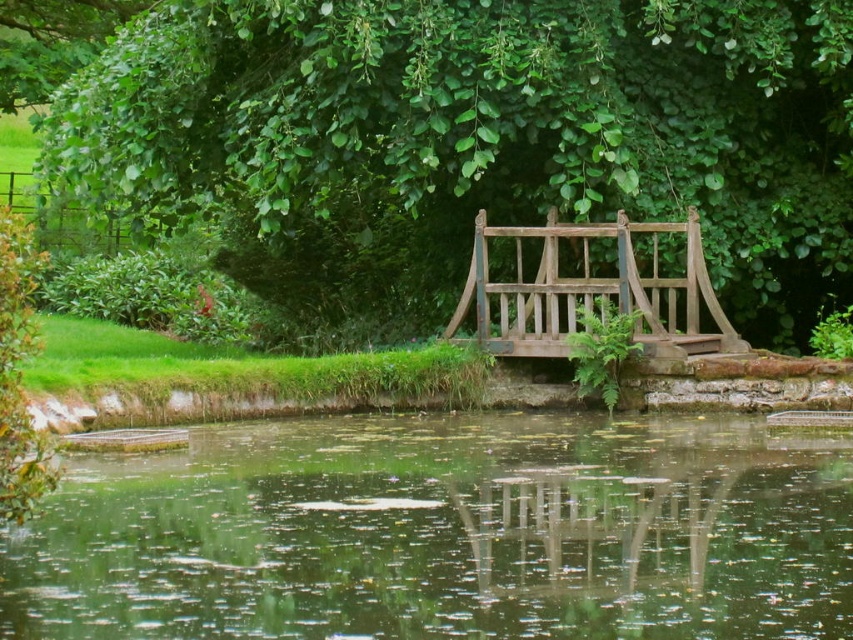
Question: Which is farther from the green leafy tree at center?

Choices:
 (A) wooden park bench at center
 (B) green reflective water at center

Answer: (B)

Question: Is green leafy tree at center thinner than wooden park bench at center?

Choices:
 (A) yes
 (B) no

Answer: (B)

Question: Which object is positioned closest to the green reflective water at center?

Choices:
 (A) wooden park bench at center
 (B) green leafy tree at center

Answer: (A)

Question: Does green leafy tree at center have a larger size compared to wooden park bench at center?

Choices:
 (A) yes
 (B) no

Answer: (A)

Question: Observing the image, what is the correct spatial positioning of green leafy tree at center in reference to green reflective water at center?

Choices:
 (A) left
 (B) right

Answer: (A)

Question: Among these objects, which one is farthest from the camera?

Choices:
 (A) green leafy tree at center
 (B) green reflective water at center

Answer: (A)